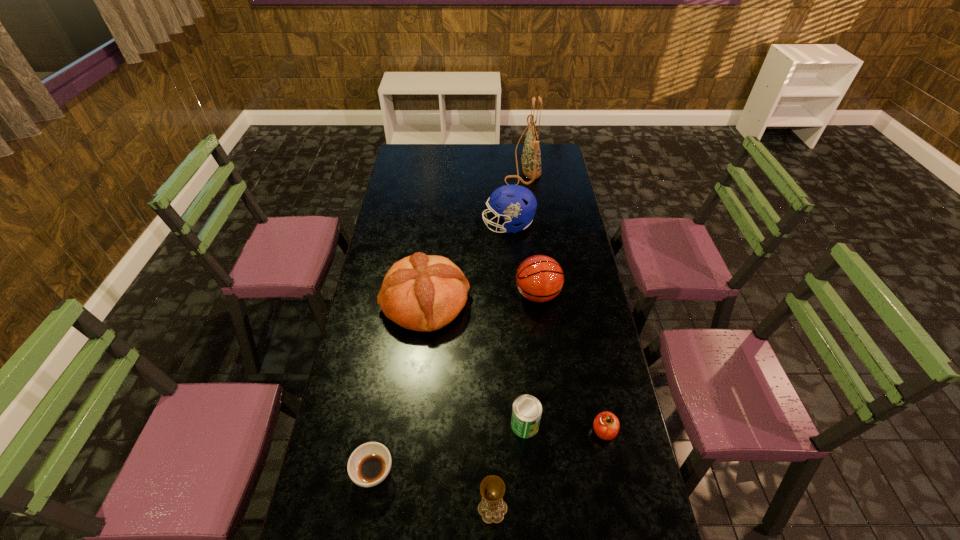
The width and height of the screenshot is (960, 540). I want to click on vacant space located on the front-facing side of the farthest object, so click(x=445, y=166).

What are the coordinates of `free space located 0.390m on the front-facing side of the farthest object` in the screenshot? It's located at (431, 166).

The image size is (960, 540). What are the coordinates of `vacant space located on the face guard of the football helmet` in the screenshot? It's located at (412, 225).

Where is `free spot located 0.380m on the face guard of the football helmet`? The width and height of the screenshot is (960, 540). free spot located 0.380m on the face guard of the football helmet is located at coordinates (399, 225).

Locate an element on the screen. The height and width of the screenshot is (540, 960). vacant space positioned 0.340m on the face guard of the football helmet is located at coordinates (408, 225).

Locate an element on the screen. The width and height of the screenshot is (960, 540). free location located 0.180m on the side with spill of the basketball is located at coordinates click(468, 295).

You are a GUI agent. You are given a task and a screenshot of the screen. Output one action in this format:
    pyautogui.click(x=<x>, y=<y>)
    Task: Click on the vacant space located 0.300m on the side with spill of the basketball
    The height and width of the screenshot is (540, 960).
    Given the screenshot: What is the action you would take?
    pyautogui.click(x=438, y=295)

Locate an element on the screen. The height and width of the screenshot is (540, 960). blank space located 0.200m on the side with spill of the basketball is located at coordinates (464, 295).

Where is `vacant space situated 0.210m on the back of the bread`? The width and height of the screenshot is (960, 540). vacant space situated 0.210m on the back of the bread is located at coordinates (433, 236).

The image size is (960, 540). What are the coordinates of `vacant space located on the left of the fourth shortest object` in the screenshot? It's located at (385, 508).